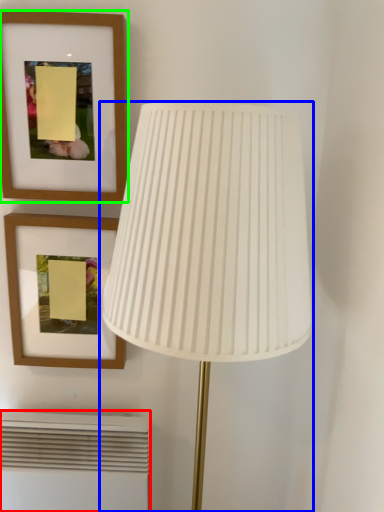
Question: Estimate the real-world distances between objects in this image. Which object is farther from air conditioner (highlighted by a red box), lamp (highlighted by a blue box) or picture frame (highlighted by a green box)?

Choices:
 (A) lamp
 (B) picture frame

Answer: (B)